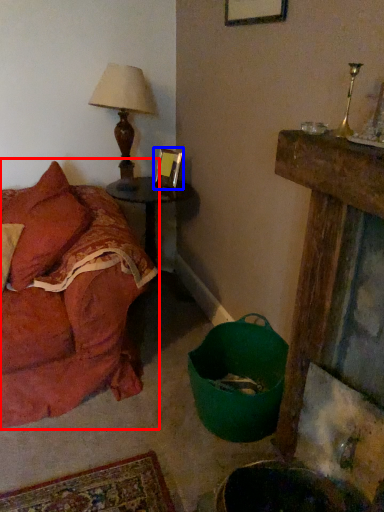
Question: Which object appears closest to the camera in this image, studio couch (highlighted by a red box) or picture frame (highlighted by a blue box)?

Choices:
 (A) studio couch
 (B) picture frame

Answer: (A)